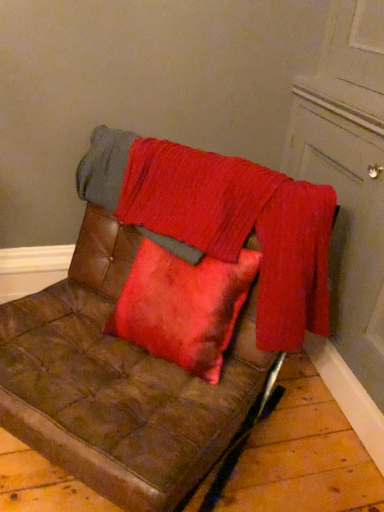
Question: From the image's perspective, is matte white door at upper right positioned above or below velvet red blanket at center?

Choices:
 (A) above
 (B) below

Answer: (A)

Question: Relative to velvet red blanket at center, is matte white door at upper right in front or behind?

Choices:
 (A) behind
 (B) front

Answer: (B)

Question: Which object is positioned farthest from the matte white door at upper right?

Choices:
 (A) velvet red blanket at center
 (B) brown leather couch at center

Answer: (B)

Question: Considering the real-world distances, which object is farthest from the brown leather couch at center?

Choices:
 (A) matte white door at upper right
 (B) velvet red blanket at center

Answer: (A)